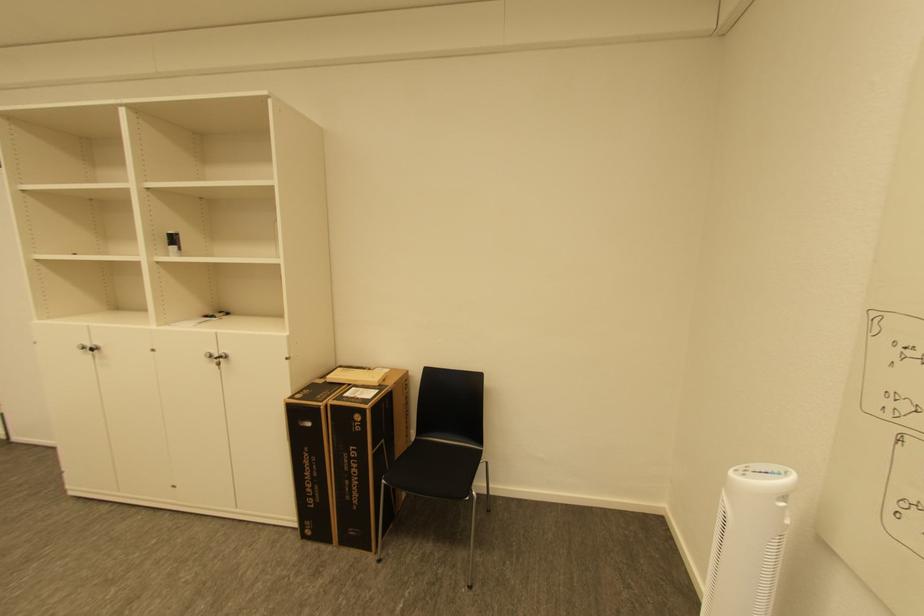
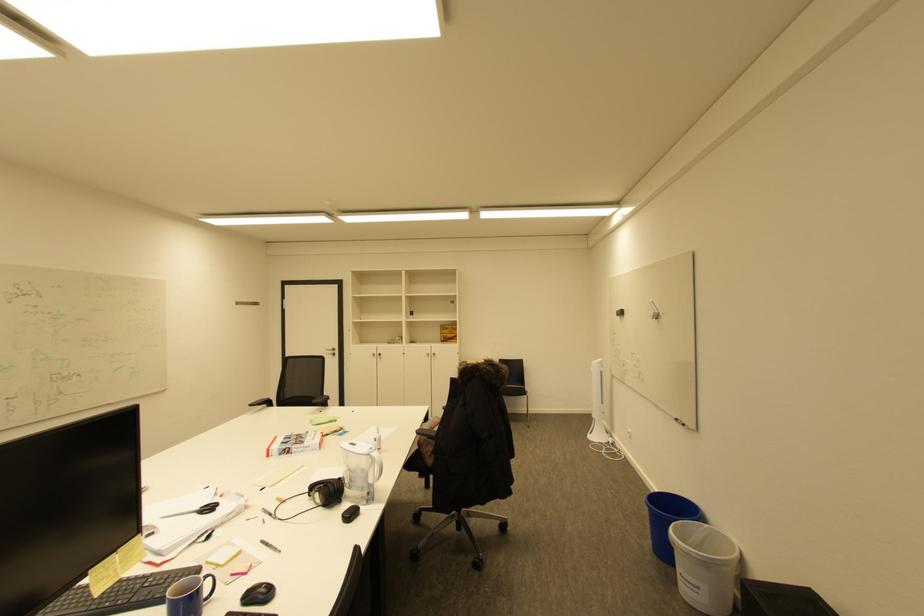
Which direction would the cameraman need to move to produce the second image?

The cameraman walked toward left, backward.